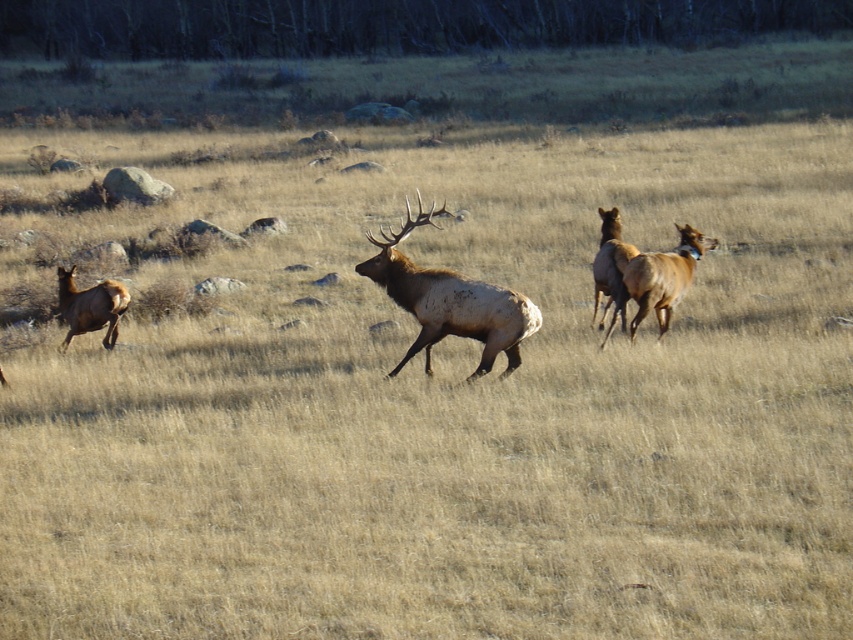
You are a wildlife photographer aiming to capture the brown velvet deer at left and the brown velvet antlered deer at center in a single frame. Based on their sizes, which deer should you focus on first to ensure both fit in the shot?

The brown velvet deer at left is wider than the brown velvet antlered deer at center, so focusing on the brown velvet deer at left first would help ensure both fit in the shot since it takes up more space.

You are a photographer trying to capture the brown velvet deer at center in your shot. Based on the scene description, where should you position your camera to ensure the deer is centered in the frame?

To center the brown velvet deer at center in your frame, position your camera so that the deer is at the point specified by the coordinates 0.472 on the x axis and 0.529 on the y axis, which corresponds to the deer being slightly to the right and above the exact center of the image.